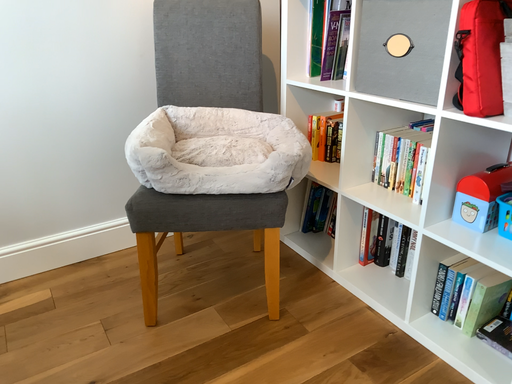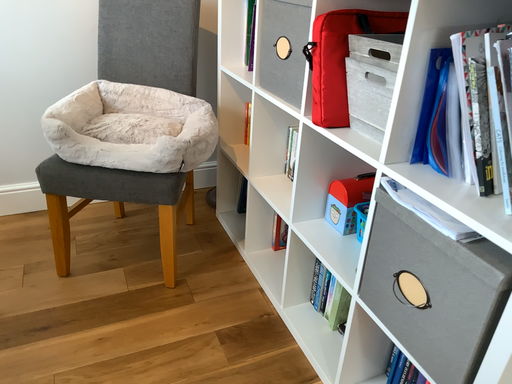
Question: How did the camera likely rotate when shooting the video?

Choices:
 (A) rotated left
 (B) rotated right

Answer: (A)